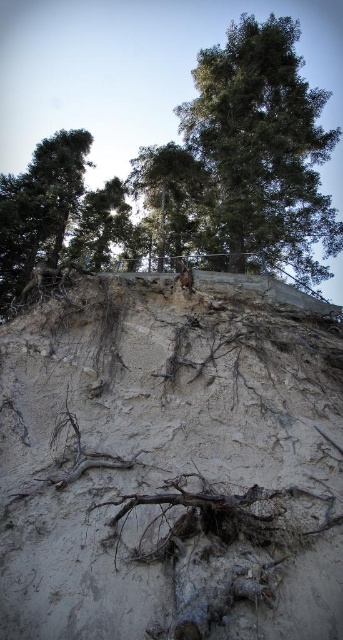
Between green matte tree at upper left and green leafy tree at center, which one appears on the right side from the viewer's perspective?

green leafy tree at center

Consider the image. Does green matte tree at upper left appear over green leafy tree at center?

Incorrect, green matte tree at upper left is not positioned above green leafy tree at center.

Find the location of a particular element. green matte tree at upper left is located at coordinates (39, 208).

Based on the photo, does white sandy hillside at center appear on the left side of green matte tree at upper left?

In fact, white sandy hillside at center is to the right of green matte tree at upper left.

What do you see at coordinates (171, 464) in the screenshot? The image size is (343, 640). I see `white sandy hillside at center` at bounding box center [171, 464].

Find the location of `white sandy hillside at center`. white sandy hillside at center is located at coordinates (171, 464).

Is green leafy tree at upper center shorter than green leafy tree at center?

Incorrect, green leafy tree at upper center's height does not fall short of green leafy tree at center's.

Does green leafy tree at upper center appear on the left side of green leafy tree at center?

No, green leafy tree at upper center is not to the left of green leafy tree at center.

Which is behind, point (297, 124) or point (158, 220)?

Point (158, 220)

Locate an element on the screen. The height and width of the screenshot is (640, 343). green leafy tree at upper center is located at coordinates click(x=265, y=145).